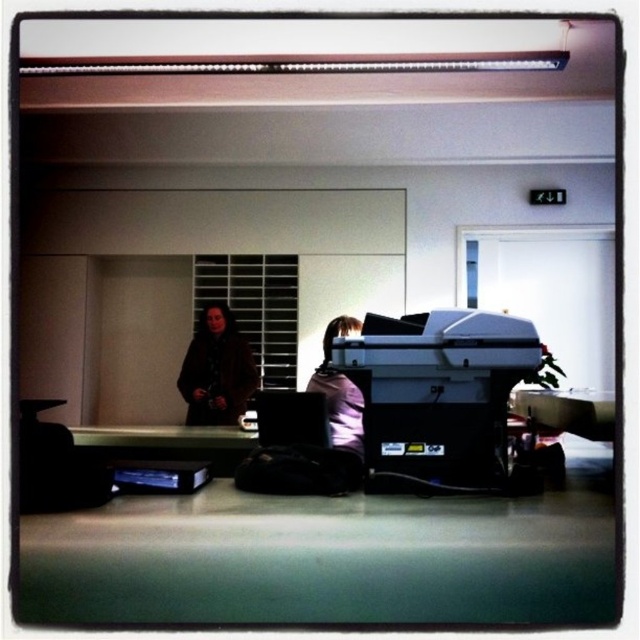
You are setting up a new printer in an office. You have two printers to choose from, the matte black printer at center and the black plastic printer at center. Which one will you choose if you want a taller printer?

The matte black printer at center is much taller than the black plastic printer at center, so you should choose the matte black printer at center for a taller option.

You need to place a 12 cm wide document on the desk. The document must be placed between the matte black printer at center and the brown leather jacket at center. Is there enough space between them for the document?

The matte black printer at center is narrower than the brown leather jacket at center. However, the exact distance between them isn not specified in the provided information. Therefore, it is unclear if there is sufficient space for the 12 cm wide document.

You are standing in the office scene and want to reach both points marked on the desk. Which point, point 1 at coordinates (442, 484) or point 2 at coordinates (292, 417), is closer to you?

Point 1 at coordinates (442, 484) is closer to you than point 2 at coordinates (292, 417).